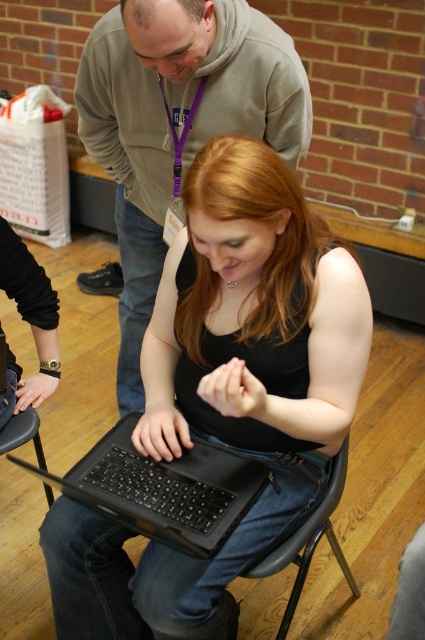
Can you confirm if black matte laptop at center is wider than black plastic chair at lower center?

Indeed, black matte laptop at center has a greater width compared to black plastic chair at lower center.

Is black matte laptop at center thinner than black plastic chair at lower center?

Incorrect, black matte laptop at center's width is not less than black plastic chair at lower center's.

Is point (110, 435) in front of point (297, 595)?

No, it is not.

Where is `black matte laptop at center`? black matte laptop at center is located at coordinates (163, 490).

Can you confirm if black matte laptop at center is positioned below black plastic chair at lower left?

Actually, black matte laptop at center is above black plastic chair at lower left.

Is point (101, 465) closer to viewer compared to point (19, 436)?

Yes, point (101, 465) is in front of point (19, 436).

What do you see at coordinates (163, 490) in the screenshot? I see `black matte laptop at center` at bounding box center [163, 490].

Where is `black matte laptop at center`? The height and width of the screenshot is (640, 425). black matte laptop at center is located at coordinates (163, 490).

Which is behind, point (159, 176) or point (302, 577)?

Positioned behind is point (159, 176).

Between gray hoodie at upper center and black plastic chair at lower center, which one is positioned higher?

gray hoodie at upper center is higher up.

Who is more distant from viewer, (122, 173) or (254, 566)?

The point (122, 173) is behind.

Locate an element on the screen. This screenshot has width=425, height=640. gray hoodie at upper center is located at coordinates (178, 122).